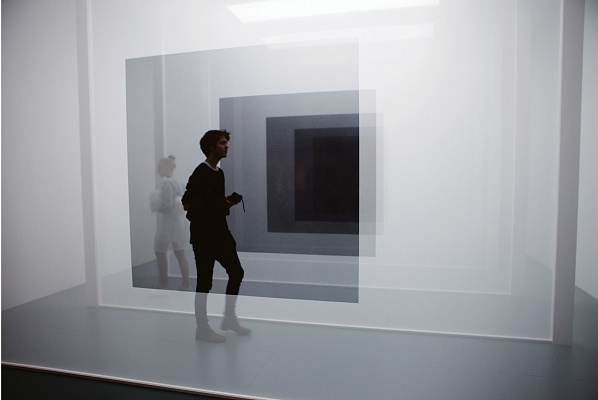
Locate an element on the screen. This screenshot has height=400, width=598. wall is located at coordinates (24, 178).